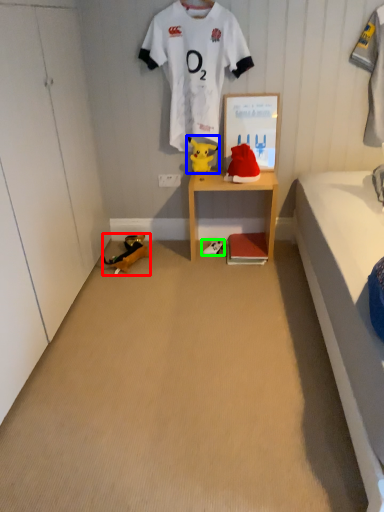
Question: Estimate the real-world distances between objects in this image. Which object is farther from toy (highlighted by a red box), toy (highlighted by a blue box) or footwear (highlighted by a green box)?

Choices:
 (A) toy
 (B) footwear

Answer: (A)